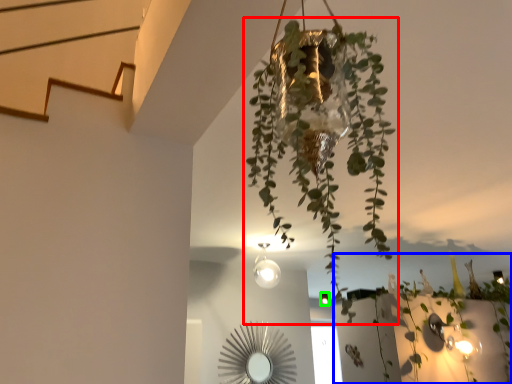
Question: Based on their relative distances, which object is farther from houseplant (highlighted by a red box)? Choose from plant (highlighted by a blue box) and light fixture (highlighted by a green box).

Choices:
 (A) plant
 (B) light fixture

Answer: (B)